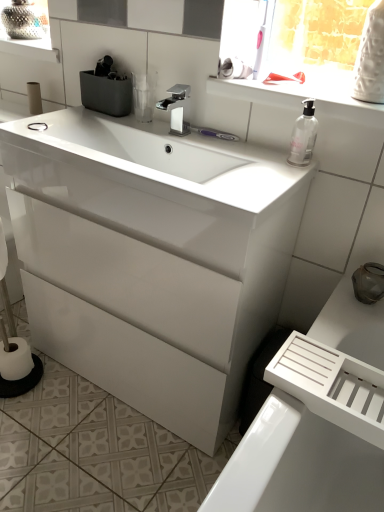
How much space does white matte toilet paper at lower left, the 1th toilet paper in the left-to-right sequence, occupy horizontally?

The width of white matte toilet paper at lower left, the 1th toilet paper in the left-to-right sequence, is 4.26 inches.

Find the location of `white matte toilet paper at left, which is the 2th toilet paper from right to left`. white matte toilet paper at left, which is the 2th toilet paper from right to left is located at coordinates (34, 98).

In order to face clear glass soap dispenser at upper right, should I rotate leftwards or rightwards?

You should look right and rotate roughly 15.042 degrees.

What do you see at coordinates (303, 135) in the screenshot?
I see `clear glass soap dispenser at upper right` at bounding box center [303, 135].

Where is `polished chrome faucet at center`? polished chrome faucet at center is located at coordinates (176, 108).

The image size is (384, 512). Describe the element at coordinates (176, 108) in the screenshot. I see `polished chrome faucet at center` at that location.

How much space does white matte toilet paper at upper center, acting as the 1th toilet paper starting from the right, occupy horizontally?

It is 12.63 centimeters.

Find the location of `white matte toilet paper at lower left, arranged as the third toilet paper when viewed from the right`. white matte toilet paper at lower left, arranged as the third toilet paper when viewed from the right is located at coordinates (15, 359).

Does white matte toilet paper at lower left, the first toilet paper when ordered from bottom to top, turn towards white glossy cabinet at center?

No, white matte toilet paper at lower left, the first toilet paper when ordered from bottom to top, is not aimed at white glossy cabinet at center.

Is white matte toilet paper at lower left, the first toilet paper when ordered from bottom to top, wider than white glossy cabinet at center?

In fact, white matte toilet paper at lower left, the first toilet paper when ordered from bottom to top, might be narrower than white glossy cabinet at center.

Would you consider white matte toilet paper at lower left, the 1th toilet paper in the left-to-right sequence, to be distant from white glossy cabinet at center?

No, there isn't a large distance between white matte toilet paper at lower left, the 1th toilet paper in the left-to-right sequence, and white glossy cabinet at center.

From a real-world perspective, is white matte toilet paper at lower left, the 1th toilet paper in the left-to-right sequence, on white glossy cabinet at center?

Incorrect, from a real-world perspective, white matte toilet paper at lower left, the 1th toilet paper in the left-to-right sequence, is lower than white glossy cabinet at center.

Which object is closer to the camera, white matte toilet paper at upper center, arranged as the second toilet paper when ordered from the bottom, or white matte toilet paper at left, the 3th toilet paper when ordered from front to back?

white matte toilet paper at upper center, arranged as the second toilet paper when ordered from the bottom, is closer to the camera.

Is white matte toilet paper at upper center, acting as the 1th toilet paper starting from the right, far from white matte toilet paper at left, which is counted as the 3th toilet paper, starting from the bottom?

No, white matte toilet paper at upper center, acting as the 1th toilet paper starting from the right, is not far away from white matte toilet paper at left, which is counted as the 3th toilet paper, starting from the bottom.

From the image's perspective, is white matte toilet paper at upper center, acting as the 1th toilet paper starting from the right, positioned above or below white matte toilet paper at left, positioned as the first toilet paper in back-to-front order?

From the image's perspective, white matte toilet paper at upper center, acting as the 1th toilet paper starting from the right, appears below white matte toilet paper at left, positioned as the first toilet paper in back-to-front order.

Identify the location of toilet paper that appears above the white matte toilet paper at upper center, acting as the 1th toilet paper starting from the right (from the image's perspective). 34,98.

From the image's perspective, is white matte toilet paper at upper center, marked as the second toilet paper in a top-to-bottom arrangement, above or below white matte toilet paper at lower left, arranged as the 2th toilet paper when viewed from the back?

white matte toilet paper at upper center, marked as the second toilet paper in a top-to-bottom arrangement, is situated higher than white matte toilet paper at lower left, arranged as the 2th toilet paper when viewed from the back, in the image.

Is white matte toilet paper at upper center, which ranks as the third toilet paper in back-to-front order, facing away from white matte toilet paper at lower left, the 2th toilet paper positioned from the front?

white matte toilet paper at upper center, which ranks as the third toilet paper in back-to-front order, does not have its back to white matte toilet paper at lower left, the 2th toilet paper positioned from the front.

Which object is positioned more to the right, white matte toilet paper at upper center, acting as the 1th toilet paper starting from the right, or white matte toilet paper at lower left, the 2th toilet paper positioned from the front?

From the viewer's perspective, white matte toilet paper at upper center, acting as the 1th toilet paper starting from the right, appears more on the right side.

Does white matte toilet paper at upper center, marked as the second toilet paper in a top-to-bottom arrangement, have a greater height compared to white matte toilet paper at lower left, the first toilet paper when ordered from bottom to top?

Incorrect, the height of white matte toilet paper at upper center, marked as the second toilet paper in a top-to-bottom arrangement, is not larger of that of white matte toilet paper at lower left, the first toilet paper when ordered from bottom to top.

Can you confirm if white glossy sink at center is wider than white matte toilet paper at upper center, which ranks as the third toilet paper in back-to-front order?

Yes, white glossy sink at center is wider than white matte toilet paper at upper center, which ranks as the third toilet paper in back-to-front order.

Could you tell me if white glossy sink at center is facing white matte toilet paper at upper center, which is the 3th toilet paper in left-to-right order?

No.

Which is correct: white glossy sink at center is inside white matte toilet paper at upper center, arranged as the second toilet paper when ordered from the bottom, or outside of it?

white glossy sink at center cannot be found inside white matte toilet paper at upper center, arranged as the second toilet paper when ordered from the bottom.

Considering the positions of points (279, 178) and (238, 66), is point (279, 178) farther from camera compared to point (238, 66)?

No, it is not.

Which object is positioned more to the right, white glossy cabinet at center or polished chrome faucet at center?

polished chrome faucet at center is more to the right.

Based on the photo, is polished chrome faucet at center at the back of white glossy cabinet at center?

No, white glossy cabinet at center is not facing away from polished chrome faucet at center.

Considering the sizes of objects white glossy cabinet at center and polished chrome faucet at center in the image provided, who is shorter, white glossy cabinet at center or polished chrome faucet at center?

polished chrome faucet at center is shorter.

From the picture: Can you tell me how much white glossy cabinet at center and polished chrome faucet at center differ in facing direction?

white glossy cabinet at center and polished chrome faucet at center are facing 0.454 degrees away from each other.

Is white matte toilet paper at upper center, which ranks as the third toilet paper in back-to-front order, not near white glossy cabinet at center?

white matte toilet paper at upper center, which ranks as the third toilet paper in back-to-front order, is actually quite close to white glossy cabinet at center.

Which of these two, white matte toilet paper at upper center, which ranks as the third toilet paper in back-to-front order, or white glossy cabinet at center, stands taller?

white glossy cabinet at center is taller.

Is white matte toilet paper at upper center, arranged as the second toilet paper when ordered from the bottom, facing away from white glossy cabinet at center?

No, white matte toilet paper at upper center, arranged as the second toilet paper when ordered from the bottom,'s orientation is not away from white glossy cabinet at center.

Is white glossy sink at center facing towards polished chrome faucet at center?

No, white glossy sink at center is not turned towards polished chrome faucet at center.

From the image's perspective, would you say white glossy sink at center is positioned over polished chrome faucet at center?

No.

Find the location of a particular element. tap located above the white glossy sink at center (from a real-world perspective) is located at coordinates (176, 108).

Is white glossy sink at center taller than polished chrome faucet at center?

Incorrect, the height of white glossy sink at center is not larger of that of polished chrome faucet at center.

Where is `bathroom cabinet located in front of the white matte toilet paper at lower left, arranged as the 2th toilet paper when viewed from the back`? Image resolution: width=384 pixels, height=512 pixels. bathroom cabinet located in front of the white matte toilet paper at lower left, arranged as the 2th toilet paper when viewed from the back is located at coordinates (151, 258).

You are a GUI agent. You are given a task and a screenshot of the screen. Output one action in this format:
    pyautogui.click(x=<x>, y=<y>)
    Task: Click on the toilet paper that is the 1st object to the left of the white matte toilet paper at upper center, which ranks as the third toilet paper in back-to-front order, starting at the anchor
    The image size is (384, 512).
    Given the screenshot: What is the action you would take?
    pyautogui.click(x=34, y=98)

Looking at the image, which one is located closer to white glossy sink at center, white matte toilet paper at upper center, which is the 3th toilet paper in left-to-right order, or polished chrome faucet at center?

The object closer to white glossy sink at center is polished chrome faucet at center.

From the image, which object appears to be farther from white matte toilet paper at upper center, which is the 3th toilet paper in left-to-right order, white glossy cabinet at center or polished chrome faucet at center?

Among the two, white glossy cabinet at center is located further to white matte toilet paper at upper center, which is the 3th toilet paper in left-to-right order.

When comparing their distances from polished chrome faucet at center, does white matte toilet paper at lower left, arranged as the third toilet paper when viewed from the right, or clear glass soap dispenser at upper right seem closer?

Among the two, clear glass soap dispenser at upper right is located nearer to polished chrome faucet at center.

Considering their positions, is clear glass soap dispenser at upper right positioned further to white glossy cabinet at center than white matte toilet paper at lower left, the 1th toilet paper in the left-to-right sequence?

Based on the image, white matte toilet paper at lower left, the 1th toilet paper in the left-to-right sequence, appears to be further to white glossy cabinet at center.

Looking at the image, which one is located further to white matte toilet paper at lower left, the 2th toilet paper positioned from the front, white matte toilet paper at left, which appears as the first toilet paper when viewed from the top, or white glossy cabinet at center?

Among the two, white matte toilet paper at left, which appears as the first toilet paper when viewed from the top, is located further to white matte toilet paper at lower left, the 2th toilet paper positioned from the front.

Looking at the image, which one is located closer to white glossy cabinet at center, white glossy sink at center or white matte toilet paper at left, the 3th toilet paper when ordered from front to back?

white glossy sink at center is closer to white glossy cabinet at center.

Estimate the real-world distances between objects in this image. Which object is closer to white matte toilet paper at left, which is the 2th toilet paper from right to left, white matte toilet paper at upper center, arranged as the second toilet paper when ordered from the bottom, or white matte toilet paper at lower left, the first toilet paper when ordered from bottom to top?

Among the two, white matte toilet paper at upper center, arranged as the second toilet paper when ordered from the bottom, is located nearer to white matte toilet paper at left, which is the 2th toilet paper from right to left.

Estimate the real-world distances between objects in this image. Which object is closer to clear glass soap dispenser at upper right, white glossy sink at center or white matte toilet paper at upper center, arranged as the second toilet paper when ordered from the bottom?

white matte toilet paper at upper center, arranged as the second toilet paper when ordered from the bottom, is positioned closer to the anchor clear glass soap dispenser at upper right.

Where is `sink between polished chrome faucet at center and white glossy cabinet at center in the vertical direction`? sink between polished chrome faucet at center and white glossy cabinet at center in the vertical direction is located at coordinates (161, 157).

Identify the location of sink between white matte toilet paper at left, the 2th toilet paper positioned from the left, and white matte toilet paper at upper center, positioned as the first toilet paper in front-to-back order. The width and height of the screenshot is (384, 512). pyautogui.click(x=161, y=157).

The image size is (384, 512). I want to click on soap dispenser between white matte toilet paper at upper center, acting as the 1th toilet paper starting from the right, and white glossy cabinet at center from top to bottom, so click(x=303, y=135).

Where is `tap between white matte toilet paper at left, which is the 2th toilet paper from right to left, and white matte toilet paper at upper center, marked as the second toilet paper in a top-to-bottom arrangement, in the horizontal direction`? tap between white matte toilet paper at left, which is the 2th toilet paper from right to left, and white matte toilet paper at upper center, marked as the second toilet paper in a top-to-bottom arrangement, in the horizontal direction is located at coordinates (176, 108).